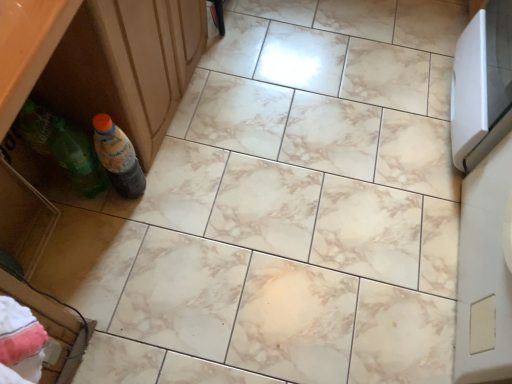
Describe the element at coordinates (24, 218) in the screenshot. The height and width of the screenshot is (384, 512). I see `green plastic drawer at lower left` at that location.

Where is `green plastic drawer at lower left`? The image size is (512, 384). green plastic drawer at lower left is located at coordinates (24, 218).

The height and width of the screenshot is (384, 512). What do you see at coordinates (118, 157) in the screenshot? I see `translucent plastic bottle at lower left` at bounding box center [118, 157].

Where is `translucent plastic bottle at lower left`? translucent plastic bottle at lower left is located at coordinates (118, 157).

Identify the location of green plastic drawer at lower left. This screenshot has height=384, width=512. (24, 218).

Between translucent plastic bottle at lower left and green plastic drawer at lower left, which one appears on the right side from the viewer's perspective?

translucent plastic bottle at lower left is more to the right.

Which object is further away from the camera, translucent plastic bottle at lower left or green plastic drawer at lower left?

translucent plastic bottle at lower left is behind.

Does point (125, 146) appear closer or farther from the camera than point (8, 205)?

Point (125, 146) is closer to the camera than point (8, 205).

From the image's perspective, who appears lower, translucent plastic bottle at lower left or green plastic drawer at lower left?

green plastic drawer at lower left is shown below in the image.

From a real-world perspective, which is physically below, translucent plastic bottle at lower left or green plastic drawer at lower left?

From a 3D spatial view, translucent plastic bottle at lower left is below.

Considering the relative sizes of translucent plastic bottle at lower left and green plastic drawer at lower left in the image provided, is translucent plastic bottle at lower left thinner than green plastic drawer at lower left?

Indeed, translucent plastic bottle at lower left has a lesser width compared to green plastic drawer at lower left.

Is translucent plastic bottle at lower left taller or shorter than green plastic drawer at lower left?

Clearly, translucent plastic bottle at lower left is shorter compared to green plastic drawer at lower left.

Considering the relative sizes of translucent plastic bottle at lower left and green plastic drawer at lower left in the image provided, is translucent plastic bottle at lower left smaller than green plastic drawer at lower left?

Indeed, translucent plastic bottle at lower left has a smaller size compared to green plastic drawer at lower left.

Is green plastic drawer at lower left surrounded by translucent plastic bottle at lower left?

No, green plastic drawer at lower left is not inside translucent plastic bottle at lower left.

Is translucent plastic bottle at lower left positioned far away from green plastic drawer at lower left?

translucent plastic bottle at lower left is actually quite close to green plastic drawer at lower left.

Based on the photo, could you tell me if translucent plastic bottle at lower left is facing green plastic drawer at lower left?

No, translucent plastic bottle at lower left is not facing towards green plastic drawer at lower left.

How many degrees apart are the facing directions of translucent plastic bottle at lower left and green plastic drawer at lower left?

The angular difference between translucent plastic bottle at lower left and green plastic drawer at lower left is 6.38 degrees.

Find the location of a particular element. drawer above the translucent plastic bottle at lower left (from a real-world perspective) is located at coordinates (24, 218).

Is green plastic drawer at lower left at the right side of translucent plastic bottle at lower left?

Incorrect, green plastic drawer at lower left is not on the right side of translucent plastic bottle at lower left.

Relative to translucent plastic bottle at lower left, is green plastic drawer at lower left in front or behind?

In the image, green plastic drawer at lower left appears in front of translucent plastic bottle at lower left.

Considering the positions of point (18, 229) and point (109, 150), is point (18, 229) closer or farther from the camera than point (109, 150)?

Point (18, 229) is farther from the camera than point (109, 150).

From the image's perspective, which one is positioned lower, green plastic drawer at lower left or translucent plastic bottle at lower left?

From the image's view, green plastic drawer at lower left is below.

Consider the image. From a real-world perspective, which is physically above, green plastic drawer at lower left or translucent plastic bottle at lower left?

In real-world perspective, green plastic drawer at lower left is above.

Looking at this image, between green plastic drawer at lower left and translucent plastic bottle at lower left, which one has larger width?

green plastic drawer at lower left is wider.

From the picture: Considering the sizes of objects green plastic drawer at lower left and translucent plastic bottle at lower left in the image provided, who is taller, green plastic drawer at lower left or translucent plastic bottle at lower left?

Standing taller between the two is green plastic drawer at lower left.

Considering the sizes of green plastic drawer at lower left and translucent plastic bottle at lower left in the image, is green plastic drawer at lower left bigger or smaller than translucent plastic bottle at lower left?

Clearly, green plastic drawer at lower left is larger in size than translucent plastic bottle at lower left.

Is translucent plastic bottle at lower left surrounded by green plastic drawer at lower left?

No.

Are green plastic drawer at lower left and translucent plastic bottle at lower left far apart?

Actually, green plastic drawer at lower left and translucent plastic bottle at lower left are a little close together.

Could you tell me if green plastic drawer at lower left is turned towards translucent plastic bottle at lower left?

No, green plastic drawer at lower left is not turned towards translucent plastic bottle at lower left.

At what (x,y) coordinates should I click in order to perform the action: click on drawer on the left of translucent plastic bottle at lower left. Please return your answer as a coordinate pair (x, y). Looking at the image, I should click on (24, 218).

Find the location of a particular element. The image size is (512, 384). bottle behind the green plastic drawer at lower left is located at coordinates (118, 157).

Locate an element on the screen. This screenshot has width=512, height=384. drawer in front of the translucent plastic bottle at lower left is located at coordinates (24, 218).